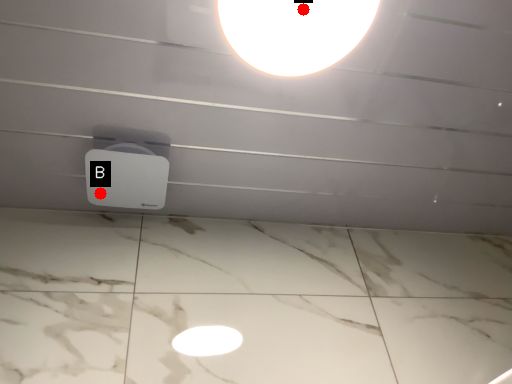
Question: Two points are circled on the image, labeled by A and B beside each circle. Which point is closer to the camera?

Choices:
 (A) A is closer
 (B) B is closer

Answer: (A)